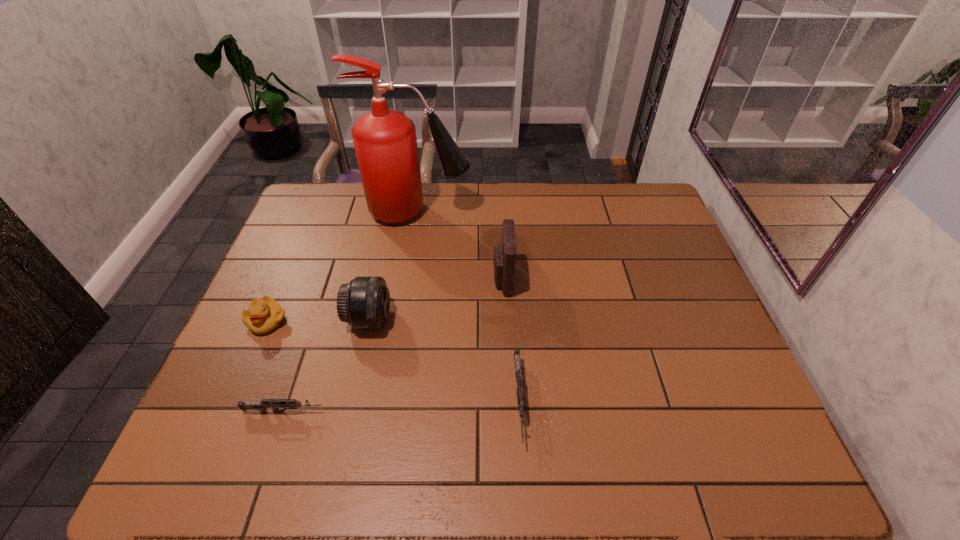
Where is `the shorter gun`? The image size is (960, 540). the shorter gun is located at coordinates pyautogui.click(x=275, y=404).

The image size is (960, 540). In order to click on the shortest object in this screenshot , I will do `click(275, 404)`.

At what (x,y) coordinates should I click in order to perform the action: click on the second shortest object. Please return your answer as a coordinate pair (x, y). The height and width of the screenshot is (540, 960). Looking at the image, I should click on (520, 395).

This screenshot has width=960, height=540. What are the coordinates of `the taller gun` in the screenshot? It's located at (520, 395).

This screenshot has height=540, width=960. Identify the location of the farthest object. (385, 142).

Locate an element on the screen. The image size is (960, 540). the tallest object is located at coordinates (385, 142).

The height and width of the screenshot is (540, 960). Identify the location of the fifth nearest object. (504, 261).

What are the coordinates of `pouch` in the screenshot? It's located at (504, 261).

Where is `telephoto lens`? The width and height of the screenshot is (960, 540). telephoto lens is located at coordinates (364, 303).

Locate an element on the screen. This screenshot has height=540, width=960. the third shortest object is located at coordinates (264, 315).